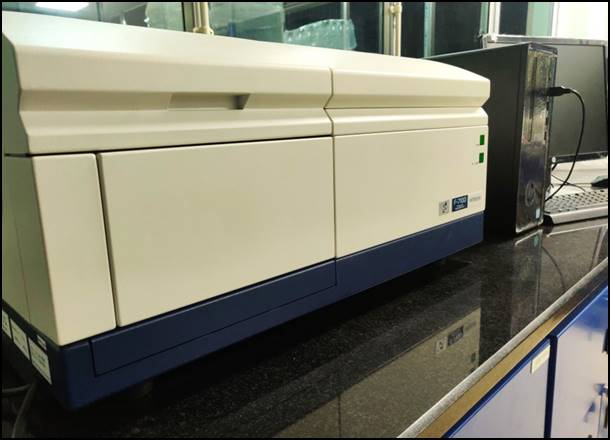
Identify the location of cabinets. This screenshot has width=610, height=440. (524, 417), (582, 357).